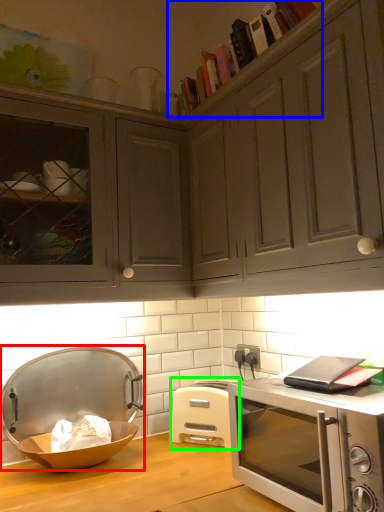
Question: Which is nearer to the appliance (highlighted by a red box)? book (highlighted by a blue box) or toaster (highlighted by a green box).

Choices:
 (A) book
 (B) toaster

Answer: (B)